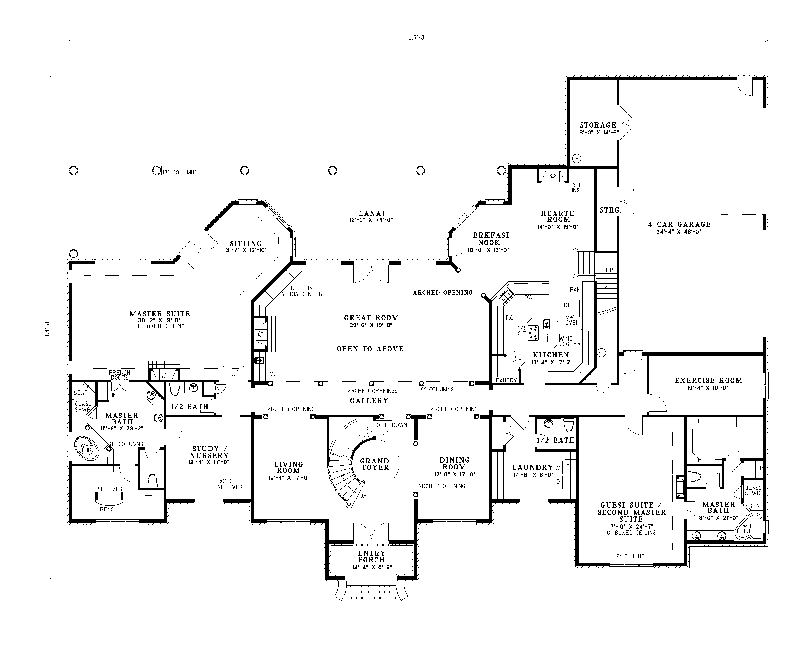
At what (x,y) coordinates should I click in order to perform the action: click on laundry room. Please return your answer as a coordinate pair (x, y). Image resolution: width=800 pixels, height=671 pixels. Looking at the image, I should click on (492, 453), (492, 498), (570, 498), (574, 452).